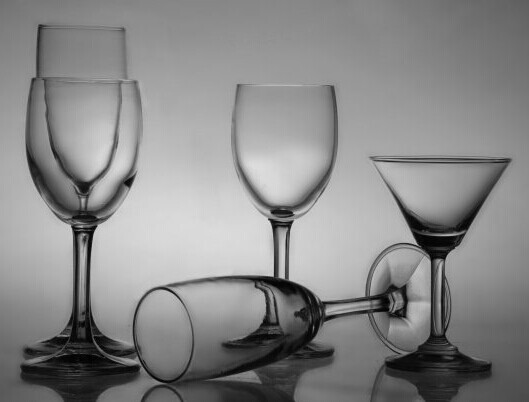
This screenshot has height=402, width=529. I want to click on lip of glass, so click(387, 160), click(282, 86), click(132, 82), click(98, 28), click(136, 313).